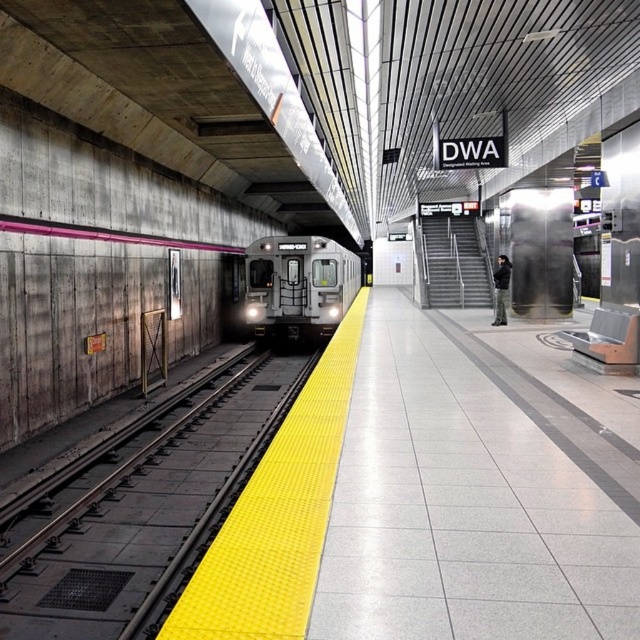
Question: Can you confirm if yellow textured platform at center is bigger than silver metallic train at center?

Choices:
 (A) yes
 (B) no

Answer: (B)

Question: Which of the following is the closest to the observer?

Choices:
 (A) silver metallic train at center
 (B) yellow textured platform at center

Answer: (B)

Question: Does yellow textured platform at center come behind silver metallic train at center?

Choices:
 (A) no
 (B) yes

Answer: (A)

Question: Does yellow textured platform at center have a larger size compared to silver metallic train at center?

Choices:
 (A) no
 (B) yes

Answer: (A)